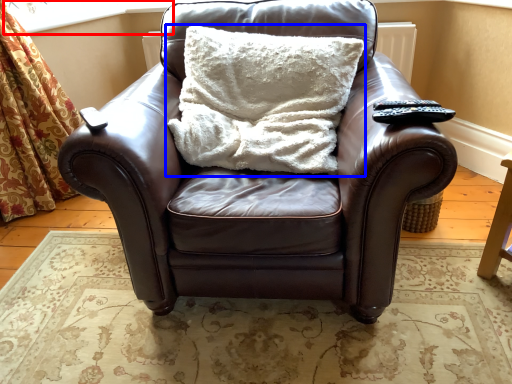
Question: Which object appears farthest to the camera in this image, window screen (highlighted by a red box) or pillow (highlighted by a blue box)?

Choices:
 (A) window screen
 (B) pillow

Answer: (A)